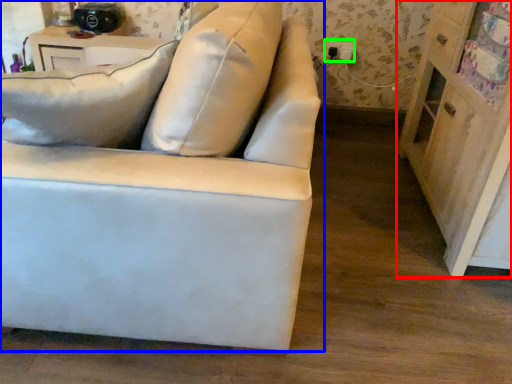
Question: Which object is positioned farthest from dresser (highlighted by a red box)? Select from studio couch (highlighted by a blue box) and electric outlet (highlighted by a green box).

Choices:
 (A) studio couch
 (B) electric outlet

Answer: (B)